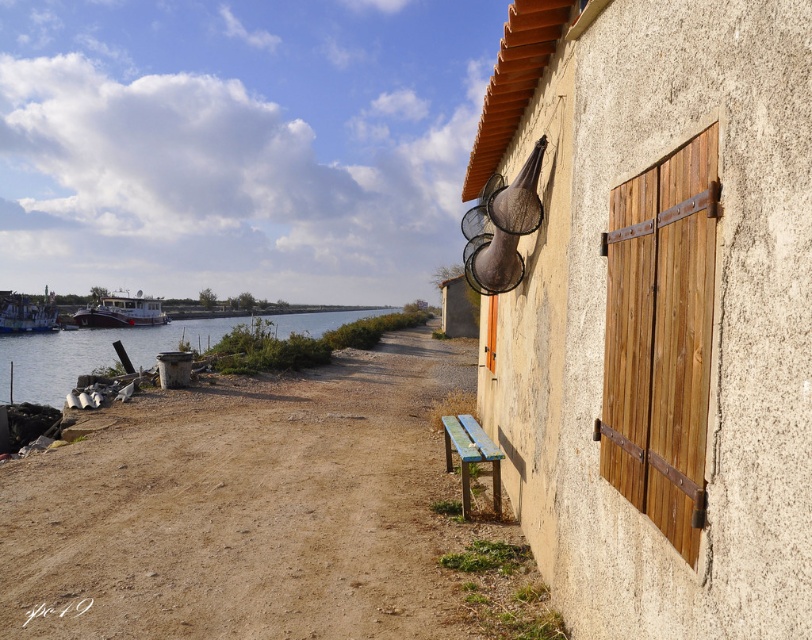
Question: Which point is farther to the camera?

Choices:
 (A) (633, 364)
 (B) (148, 317)
 (C) (5, 321)

Answer: (B)

Question: Does clear water at lower left appear on the right side of wooden bench at lower center?

Choices:
 (A) no
 (B) yes

Answer: (A)

Question: Which object is the farthest from the clear water at lower left?

Choices:
 (A) wooden bench at lower center
 (B) metallic silver boat at left

Answer: (A)

Question: Which of the following is the closest to the observer?

Choices:
 (A) (108, 333)
 (B) (37, 308)
 (C) (130, 300)

Answer: (A)

Question: Can you confirm if clear water at lower left is positioned above white glossy boat at left?

Choices:
 (A) yes
 (B) no

Answer: (B)

Question: Is natural wood shutters at right to the right of metallic silver boat at left from the viewer's perspective?

Choices:
 (A) yes
 (B) no

Answer: (A)